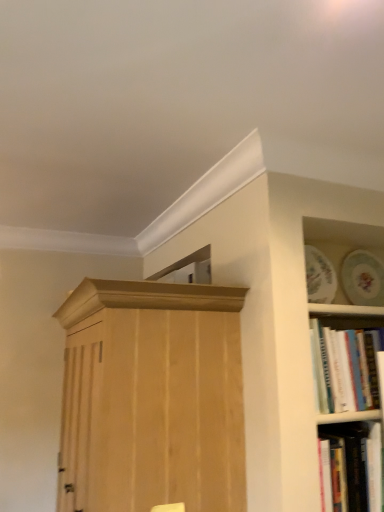
Question: In terms of width, does white paperbacks at right, the 2th book from the bottom, look wider or thinner when compared to hardcover book at lower right, which is the 2th book in top-to-bottom order?

Choices:
 (A) thin
 (B) wide

Answer: (A)

Question: Would you say white paperbacks at right, the 2th book from the bottom, is to the left or to the right of hardcover book at lower right, marked as the first book in a bottom-to-top arrangement, in the picture?

Choices:
 (A) left
 (B) right

Answer: (B)

Question: Which object is positioned closest to the natural wood cupboard at center?

Choices:
 (A) white paperbacks at right, the 2th book from the bottom
 (B) hardcover book at lower right, which is the 2th book in top-to-bottom order

Answer: (A)

Question: Which of these objects is positioned farthest from the white paperbacks at right, the 2th book from the bottom?

Choices:
 (A) natural wood cupboard at center
 (B) hardcover book at lower right, marked as the first book in a bottom-to-top arrangement

Answer: (A)